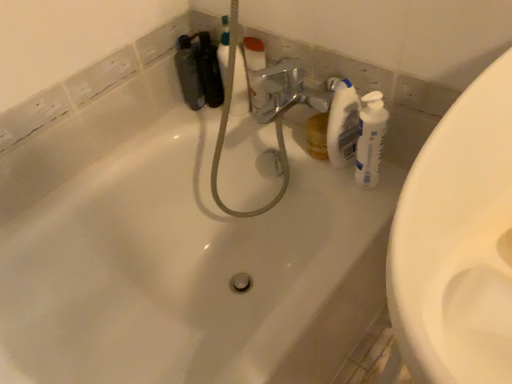
Identify the location of free location in front of white plastic bottle at right, the first cleaning product positioned from the right. This screenshot has height=384, width=512. (361, 213).